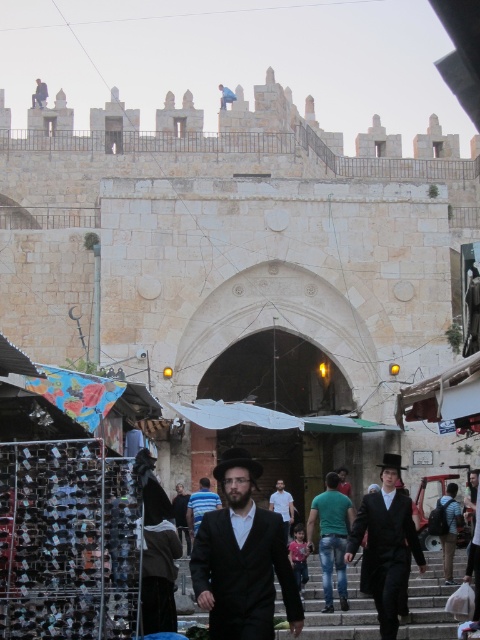
In the scene shown: Between black matte suit at center and green cotton shirt at center, which one is positioned lower?

green cotton shirt at center is below.

Does black matte suit at center have a greater width compared to green cotton shirt at center?

Yes, black matte suit at center is wider than green cotton shirt at center.

Is point (372, 552) positioned after point (317, 508)?

No, it is in front of (317, 508).

Locate an element on the screen. black matte suit at center is located at coordinates (385, 545).

Is point (331, 529) positioned behind point (191, 493)?

No, (331, 529) is in front of (191, 493).

Between point (336, 554) and point (212, 492), which one is positioned in front?

Positioned in front is point (336, 554).

Find the location of a particular element. green cotton shirt at center is located at coordinates (332, 538).

Between point (364, 596) and point (338, 579), which one is positioned in front?

Point (364, 596) is in front.

What do you see at coordinates (337, 609) in the screenshot?
I see `gray stone stairs at center` at bounding box center [337, 609].

At what (x,y) coordinates should I click in order to perform the action: click on gray stone stairs at center. Please return your answer as a coordinate pair (x, y). The image size is (480, 640). Looking at the image, I should click on (337, 609).

The height and width of the screenshot is (640, 480). What are the coordinates of `gray stone stairs at center` in the screenshot? It's located at (337, 609).